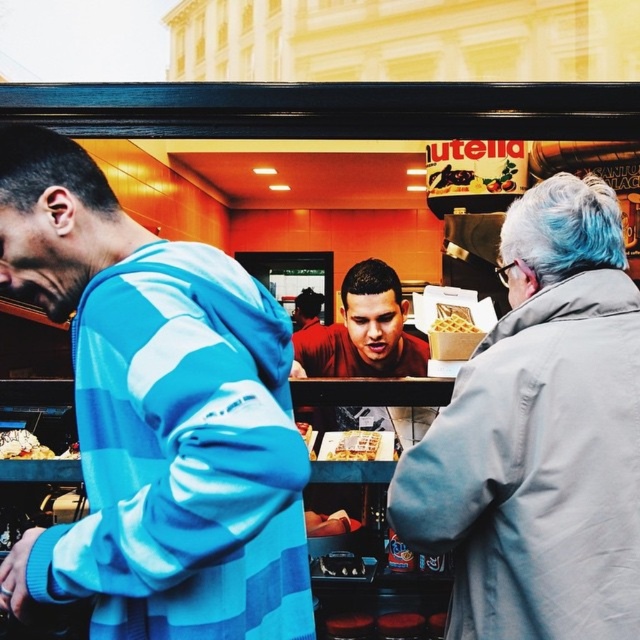
Question: Among these points, which one is farthest from the camera?

Choices:
 (A) (22, 445)
 (B) (458, 324)
 (C) (147, 410)

Answer: (A)

Question: Is white frosted cake at center thinner than golden waffle at center?

Choices:
 (A) yes
 (B) no

Answer: (B)

Question: Is smooth chocolate spread at center bigger than white frosted cake at center?

Choices:
 (A) no
 (B) yes

Answer: (B)

Question: Which point is closer to the camera?

Choices:
 (A) red matte shirt at center
 (B) white frosted cake at center
 (C) light gray coat at center
 (D) blue striped hoodie at left

Answer: (D)

Question: Is light gray coat at center further to the viewer compared to golden waffle at center?

Choices:
 (A) no
 (B) yes

Answer: (A)

Question: Estimate the real-world distances between objects in this image. Which object is farther from the blue striped hoodie at left?

Choices:
 (A) white frosted cake at center
 (B) smooth chocolate spread at center

Answer: (B)